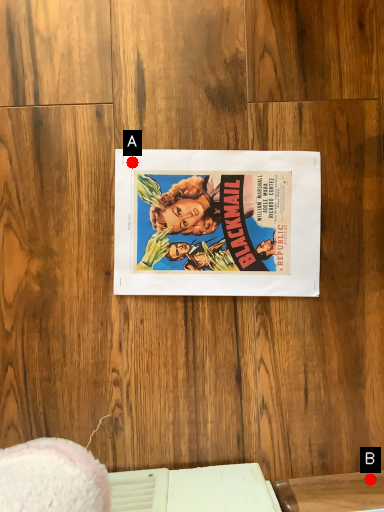
Question: Two points are circled on the image, labeled by A and B beside each circle. Which point is closer to the camera taking this photo?

Choices:
 (A) A is closer
 (B) B is closer

Answer: (B)